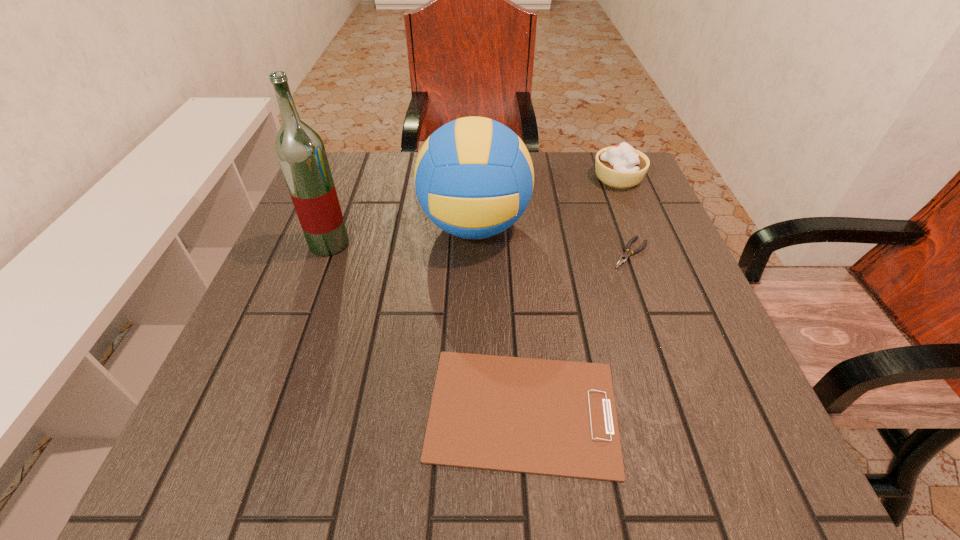
I want to click on free spot between the clipboard and the liquor, so click(426, 327).

Where is `free space between the whipped cream and the fourth shortest object`? Image resolution: width=960 pixels, height=540 pixels. free space between the whipped cream and the fourth shortest object is located at coordinates pos(546,202).

Find the location of a particular element. The width and height of the screenshot is (960, 540). free spot between the third tallest object and the clipboard is located at coordinates (570, 294).

Identify which object is the second closest to the nearest object. Please provide its 2D coordinates. Your answer should be formatted as a tuple, i.e. [(x, y)], where the tuple contains the x and y coordinates of a point satisfying the conditions above.

[(474, 177)]

Identify the location of object that is the third closest one to the leftmost object. (627, 254).

The height and width of the screenshot is (540, 960). What are the coordinates of `vacant region that satisfies the following two spatial constraints: 1. on the back side of the pliers; 2. on the left side of the clipboard` in the screenshot? It's located at (511, 253).